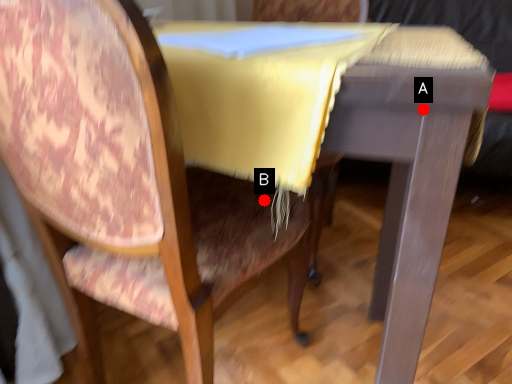
Question: Two points are circled on the image, labeled by A and B beside each circle. Among these points, which one is farthest from the camera?

Choices:
 (A) A is further
 (B) B is further

Answer: (B)